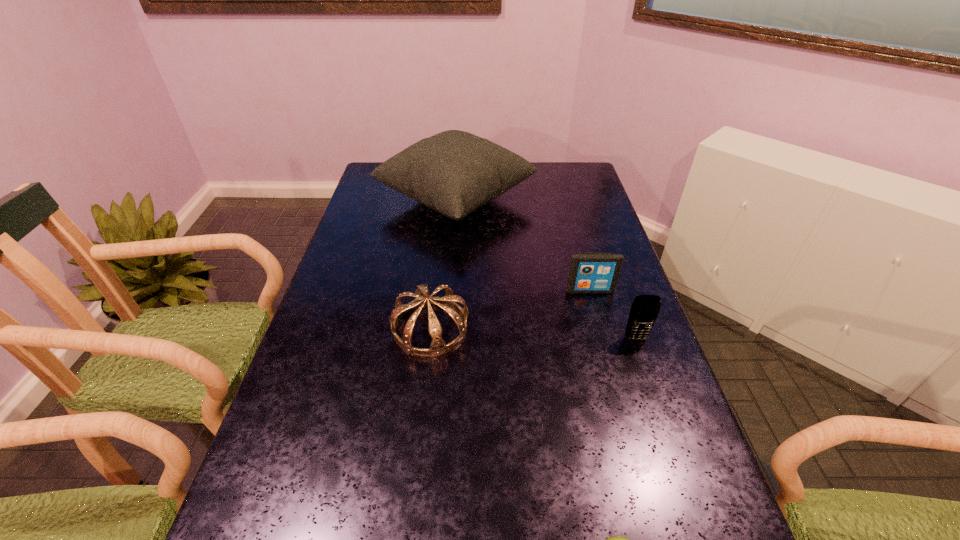
Locate an element on the screen. This screenshot has width=960, height=540. the farthest object is located at coordinates (454, 172).

This screenshot has height=540, width=960. I want to click on cushion, so click(454, 172).

The height and width of the screenshot is (540, 960). I want to click on cellular telephone, so click(x=644, y=311).

Where is `tiara`? tiara is located at coordinates (438, 346).

This screenshot has height=540, width=960. Identify the location of iPod. (589, 272).

Find the location of a particular element. The height and width of the screenshot is (540, 960). free region located on the front of the cushion is located at coordinates (448, 292).

Where is `vacant area situated 0.330m on the screen of the cellular telephone`? The height and width of the screenshot is (540, 960). vacant area situated 0.330m on the screen of the cellular telephone is located at coordinates (683, 474).

Where is `free space located 0.290m on the back of the tiara`? free space located 0.290m on the back of the tiara is located at coordinates (441, 239).

Locate an element on the screen. The width and height of the screenshot is (960, 540). free region located 0.060m on the front screen of the iPod is located at coordinates (595, 309).

Locate an element on the screen. This screenshot has width=960, height=540. object at the far edge is located at coordinates (454, 172).